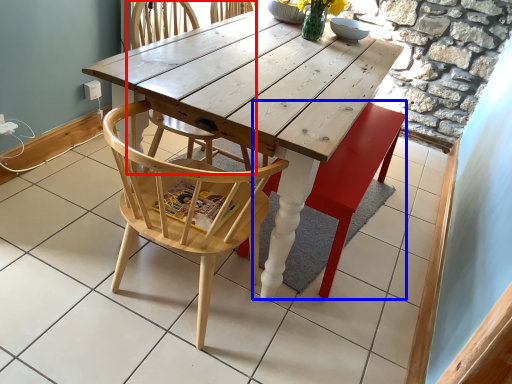
Question: Among these objects, which one is farthest to the camera, chair (highlighted by a red box) or swivel chair (highlighted by a blue box)?

Choices:
 (A) chair
 (B) swivel chair

Answer: (B)